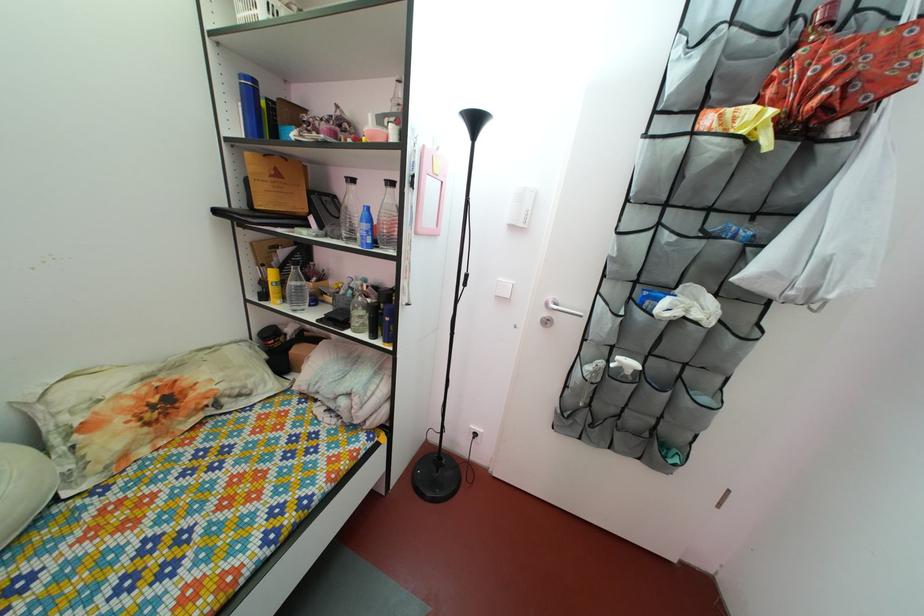
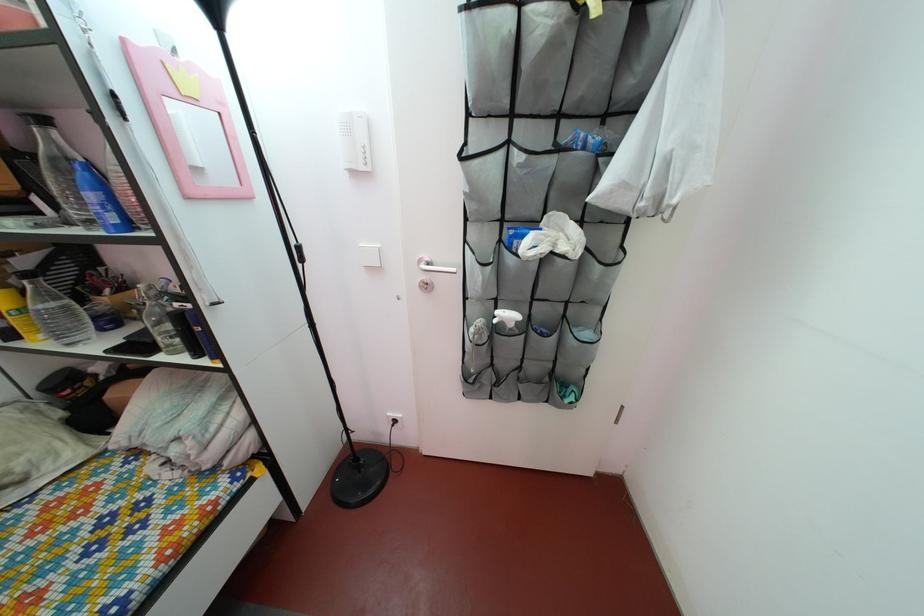
The point at (292, 262) is marked in the first image. Where is the corresponding point in the second image?

(32, 270)